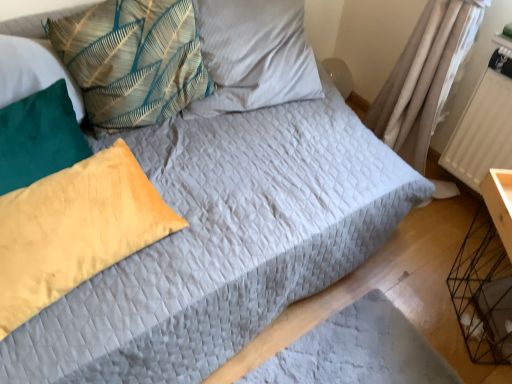
Question: Which is correct: white textured radiator at right is inside textured fabric pillow at upper center, which ranks as the 4th pillow in bottom-to-top order, or outside of it?

Choices:
 (A) outside
 (B) inside

Answer: (A)

Question: Looking at the image, does white textured radiator at right seem bigger or smaller compared to textured fabric pillow at upper center, the first pillow from the top?

Choices:
 (A) big
 (B) small

Answer: (B)

Question: Which is nearer to the black wire crate at lower right?

Choices:
 (A) white textured radiator at right
 (B) velvet yellow pillow at left, the 4th pillow when ordered from top to bottom
 (C) textured fabric pillow at upper center, the first pillow from the top
 (D) teal fabric pillow at upper left, the third pillow when ordered from bottom to top
 (E) yellow cotton pillow at left, positioned as the 2th pillow in bottom-to-top order

Answer: (A)

Question: Which object is positioned farthest from the textured fabric pillow at upper center, the first pillow from the top?

Choices:
 (A) black wire crate at lower right
 (B) yellow cotton pillow at left, positioned as the 2th pillow in bottom-to-top order
 (C) velvet yellow pillow at left, the 4th pillow when ordered from top to bottom
 (D) white textured radiator at right
 (E) teal fabric pillow at upper left, the third pillow when ordered from bottom to top

Answer: (A)